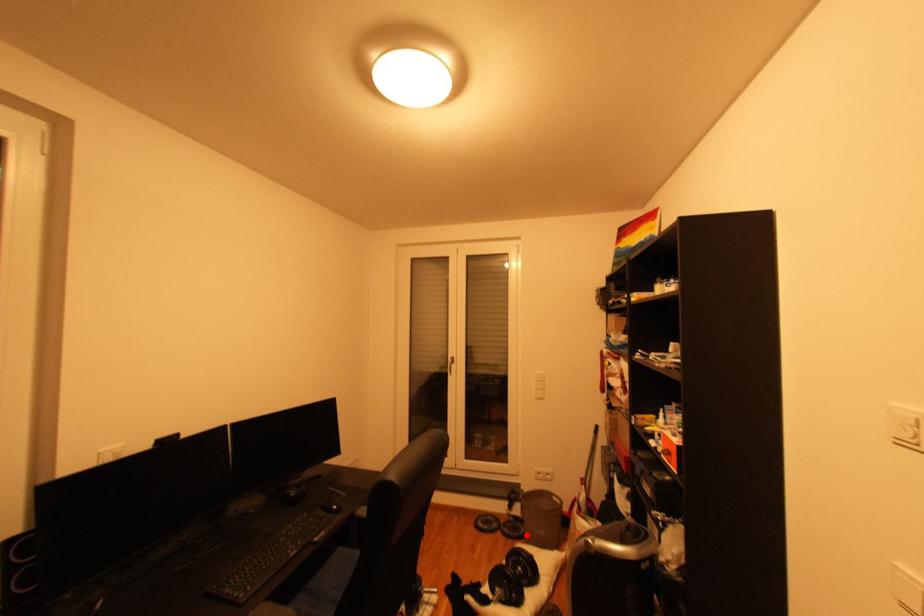
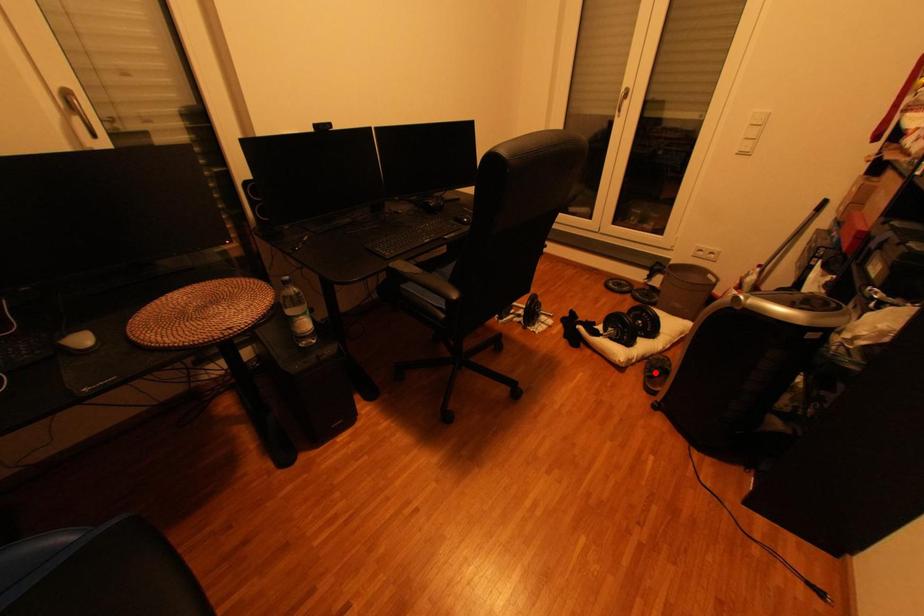
I am providing you with two images of the same scene from different viewpoints. A red point is marked on the first image and another point is marked on the second image. Are the points marked in image1 and image2 representing the same 3D position?

No